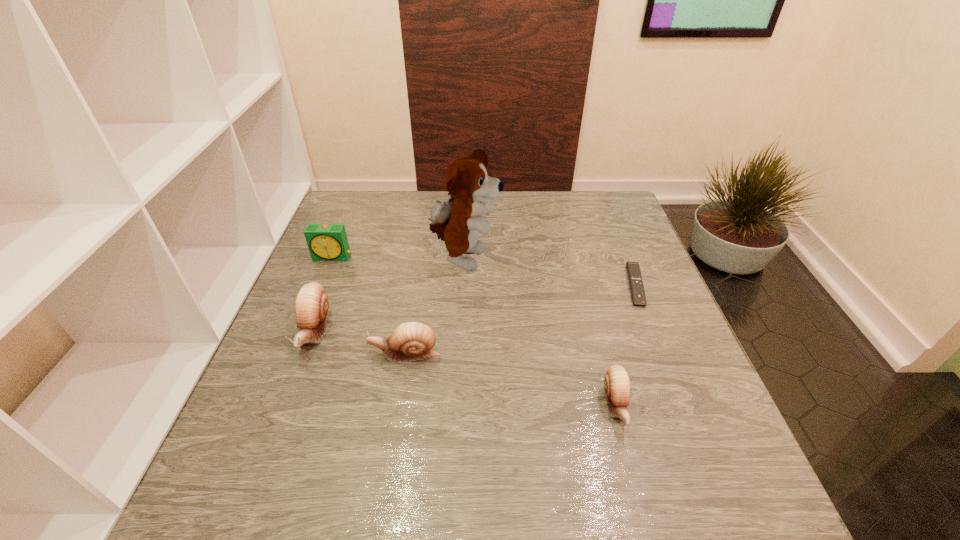
The image size is (960, 540). Find the location of `vacant region between the second tallest escargot and the alarm clock`. vacant region between the second tallest escargot and the alarm clock is located at coordinates (369, 306).

Find the location of `free area in between the remote control and the second escargot from right to left`. free area in between the remote control and the second escargot from right to left is located at coordinates (520, 320).

Identify the location of free space that is in between the shortest object and the second tallest escargot. The height and width of the screenshot is (540, 960). (520, 320).

The width and height of the screenshot is (960, 540). Identify the location of empty location between the tallest object and the leftmost escargot. (390, 296).

Where is `vacant point located between the second tallest escargot and the shortest escargot`? This screenshot has width=960, height=540. vacant point located between the second tallest escargot and the shortest escargot is located at coordinates (511, 380).

At what (x,y) coordinates should I click in order to perform the action: click on free spot between the remote control and the nearest object. Please return your answer as a coordinate pair (x, y). This screenshot has height=540, width=960. Looking at the image, I should click on (626, 346).

Select which object is the second closest to the second escargot from right to left. Please provide its 2D coordinates. Your answer should be formatted as a tuple, i.e. [(x, y)], where the tuple contains the x and y coordinates of a point satisfying the conditions above.

[(457, 221)]

Find the location of `object that stands as the fifth closest to the alarm clock`. object that stands as the fifth closest to the alarm clock is located at coordinates (633, 270).

What are the coordinates of `escargot identified as the third closest to the alarm clock` in the screenshot? It's located at point(617,385).

Locate which escargot is the second closest to the leftmost escargot. Please provide its 2D coordinates. Your answer should be formatted as a tuple, i.e. [(x, y)], where the tuple contains the x and y coordinates of a point satisfying the conditions above.

[(617, 385)]